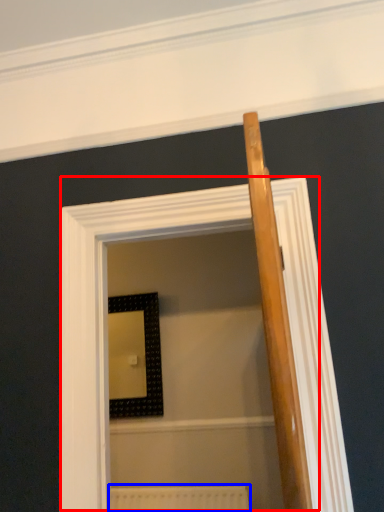
Question: Which of the following is the farthest to the observer, screen door (highlighted by a red box) or radiator (highlighted by a blue box)?

Choices:
 (A) screen door
 (B) radiator

Answer: (B)